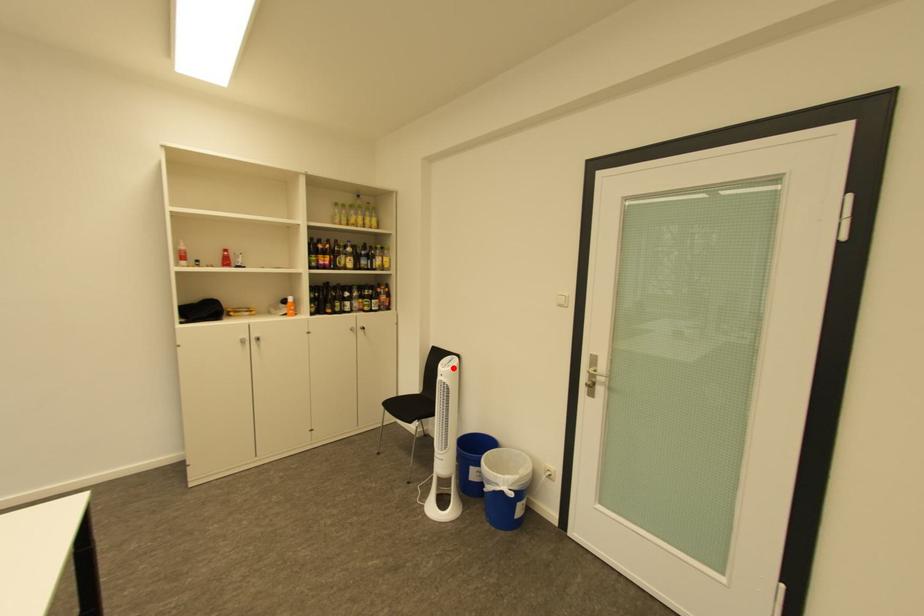
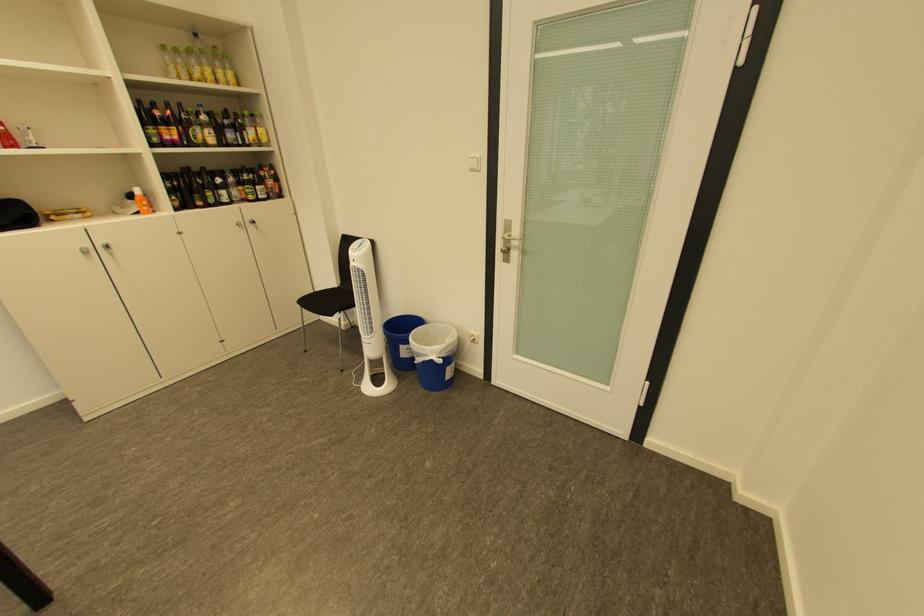
Question: I am providing you with two images of the same scene from different viewpoints. In image1, a red point is highlighted. Considering the same 3D point in image2, which of the following is correct?

Choices:
 (A) It is closer
 (B) It is farther

Answer: (A)